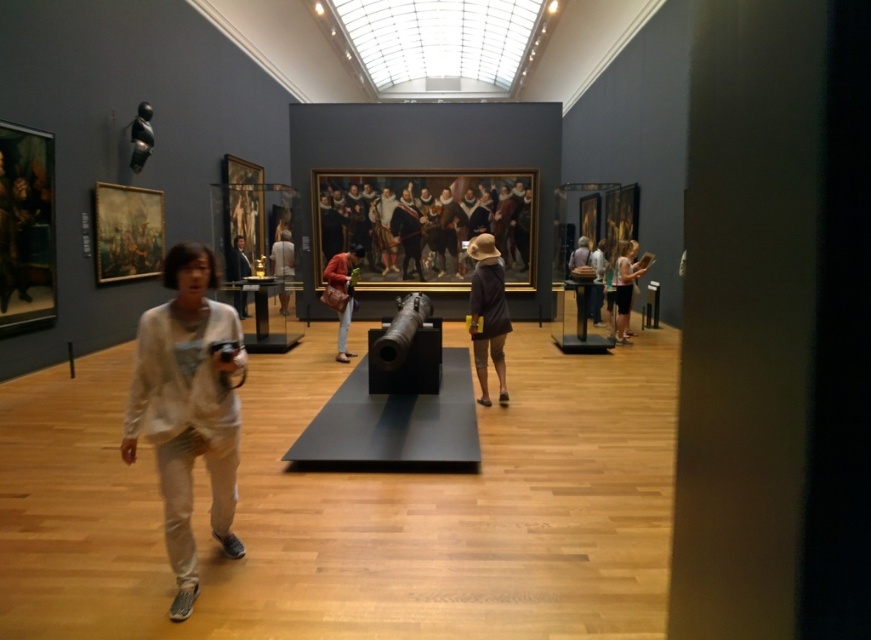
Is matte red jacket at center further to camera compared to light brown shorts at center?

No, it is in front of light brown shorts at center.

Does matte red jacket at center appear on the right side of light brown shorts at center?

No, matte red jacket at center is not to the right of light brown shorts at center.

Is point (343, 291) closer to camera compared to point (619, 310)?

Yes, it is.

Locate an element on the screen. matte red jacket at center is located at coordinates [342, 292].

Who is shorter, white cotton shirt at lower left or matte black jacket at center?

With less height is matte black jacket at center.

Between white cotton shirt at lower left and matte black jacket at center, which one appears on the left side from the viewer's perspective?

matte black jacket at center is more to the left.

You are a GUI agent. You are given a task and a screenshot of the screen. Output one action in this format:
    pyautogui.click(x=<x>, y=<y>)
    Task: Click on the white cotton shirt at lower left
    The width and height of the screenshot is (871, 640).
    Given the screenshot: What is the action you would take?
    pyautogui.click(x=187, y=408)

Where is `white cotton shirt at lower left`? The width and height of the screenshot is (871, 640). white cotton shirt at lower left is located at coordinates (187, 408).

Is dark gray fabric hat at center below matte red jacket at center?

Correct, dark gray fabric hat at center is located below matte red jacket at center.

Which is in front, point (475, 240) or point (326, 300)?

Point (475, 240) is in front.

Locate an element on the screen. dark gray fabric hat at center is located at coordinates (487, 314).